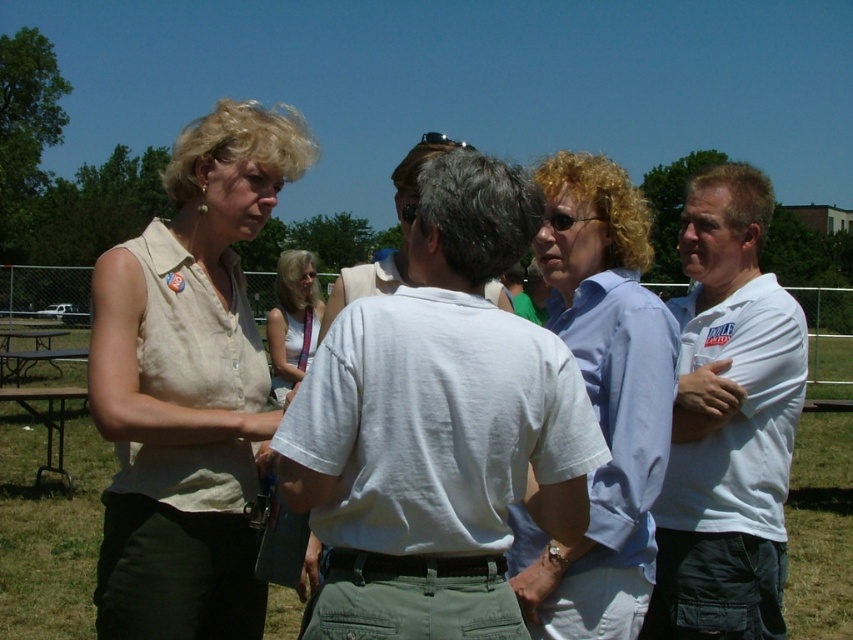
Question: Does matte beige blouse at left lie in front of brown metal picnic table at lower left?

Choices:
 (A) no
 (B) yes

Answer: (B)

Question: Which point is farther to the camera?

Choices:
 (A) (480, 230)
 (B) (286, 333)
 (C) (654, 520)

Answer: (B)

Question: Can you confirm if white cotton shirt at right is bigger than brown metal picnic table at lower left?

Choices:
 (A) yes
 (B) no

Answer: (B)

Question: Considering the relative positions of matte beige blouse at left and light blue shirt at center in the image provided, where is matte beige blouse at left located with respect to light blue shirt at center?

Choices:
 (A) below
 (B) above

Answer: (B)

Question: Which object appears closest to the camera in this image?

Choices:
 (A) white cotton shirt at right
 (B) light brown fabric tank top at center

Answer: (A)

Question: Based on their relative distances, which object is farther from the white cotton shirt at center?

Choices:
 (A) matte beige blouse at left
 (B) light blue shirt at center
 (C) white cotton shirt at right
 (D) light brown fabric tank top at center

Answer: (D)